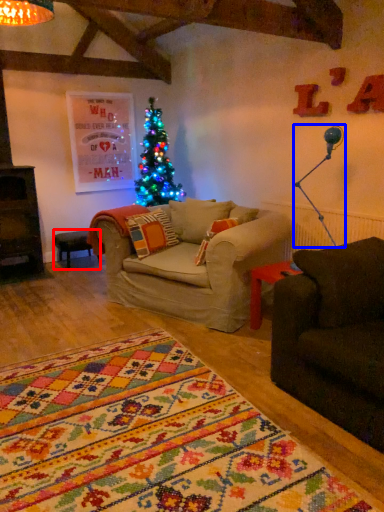
Question: Which object appears closest to the camera in this image, table (highlighted by a red box) or lamp (highlighted by a blue box)?

Choices:
 (A) table
 (B) lamp

Answer: (B)